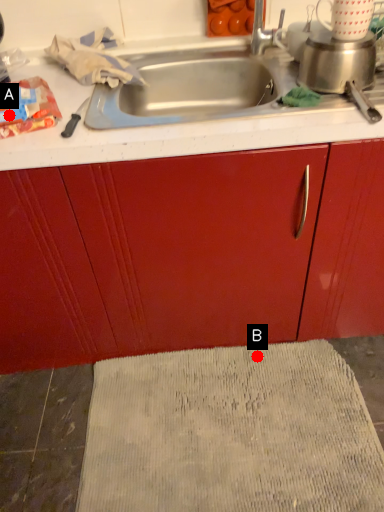
Question: Two points are circled on the image, labeled by A and B beside each circle. Which of the following is the farthest from the observer?

Choices:
 (A) A is further
 (B) B is further

Answer: (B)